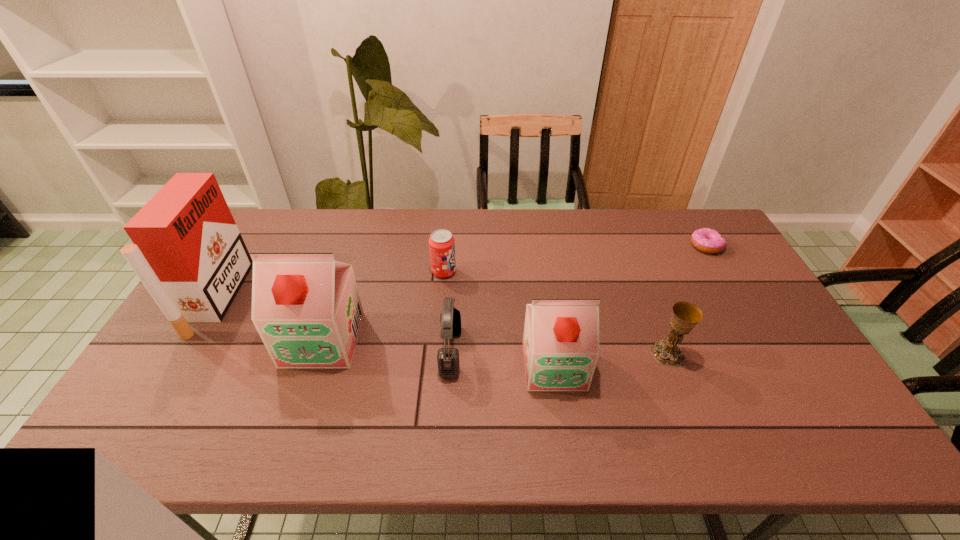
Identify the location of free space located with the cap open on the left soya milk. (303, 399).

At what (x,y) coordinates should I click in order to perform the action: click on free spot located on the surface of the second shortest object. Please return your answer as a coordinate pair (x, y). This screenshot has width=960, height=540. Looking at the image, I should click on (478, 272).

You are a GUI agent. You are given a task and a screenshot of the screen. Output one action in this format:
    pyautogui.click(x=<x>, y=<y>)
    Task: Click on the free space located 0.390m on the left of the shortest object
    The width and height of the screenshot is (960, 540).
    Given the screenshot: What is the action you would take?
    pyautogui.click(x=577, y=246)

This screenshot has height=540, width=960. Identify the location of vacant space situated on the front-facing side of the cigarette case. (353, 299).

This screenshot has width=960, height=540. I want to click on free space located 0.370m on the back of the second object from right to left, so click(630, 255).

Identify the location of vacant space situated on the headband of the headset. This screenshot has width=960, height=540. (605, 352).

What are the coordinates of `object at the far edge` in the screenshot? It's located at (706, 240).

Locate an element on the screen. Image resolution: width=960 pixels, height=540 pixels. soya milk located at the near edge is located at coordinates (561, 346).

Identify the location of headset located in the near edge section of the desktop. (447, 358).

I want to click on object that is positioned at the left edge, so click(x=188, y=252).